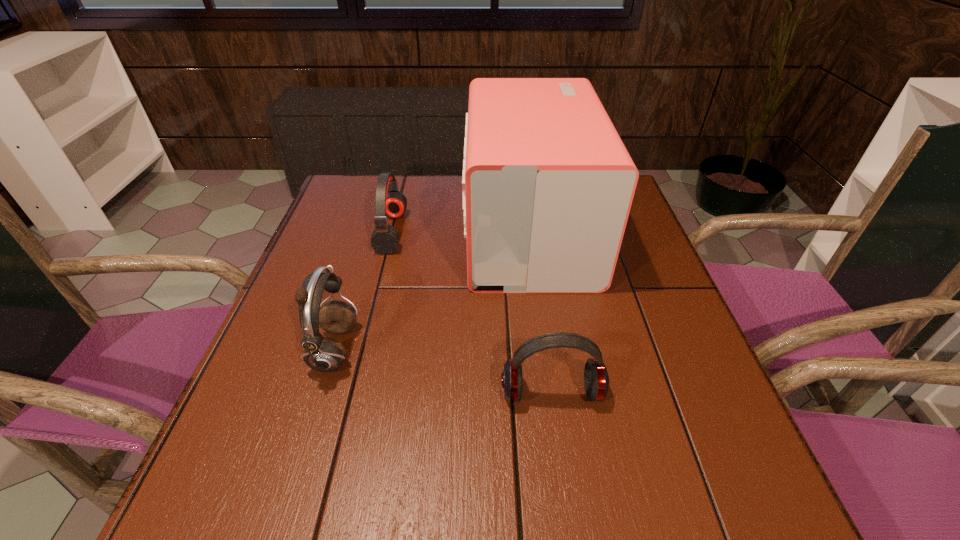
Identify the location of free space at the near left corner. The image size is (960, 540). (183, 523).

Locate an element on the screen. This screenshot has height=540, width=960. empty space between the tallest object and the farthest earphone is located at coordinates (461, 232).

This screenshot has width=960, height=540. Identify the location of free spot between the box and the rightmost earphone. (540, 312).

Where is `vacant space in between the tallest object and the farthest earphone`? The height and width of the screenshot is (540, 960). vacant space in between the tallest object and the farthest earphone is located at coordinates (461, 232).

Locate an element on the screen. The image size is (960, 540). free space between the rightmost earphone and the tallest earphone is located at coordinates (444, 372).

Locate an element on the screen. The width and height of the screenshot is (960, 540). vacant space in between the rightmost earphone and the box is located at coordinates (540, 312).

Identify the location of free area in between the tallest earphone and the tallest object. (432, 291).

This screenshot has height=540, width=960. I want to click on vacant point located between the tallest earphone and the farthest earphone, so click(364, 291).

The height and width of the screenshot is (540, 960). Find the location of `free space between the rightmost earphone and the box`. free space between the rightmost earphone and the box is located at coordinates (540, 312).

The image size is (960, 540). In order to click on free space between the third shortest object and the box in this screenshot , I will do `click(432, 291)`.